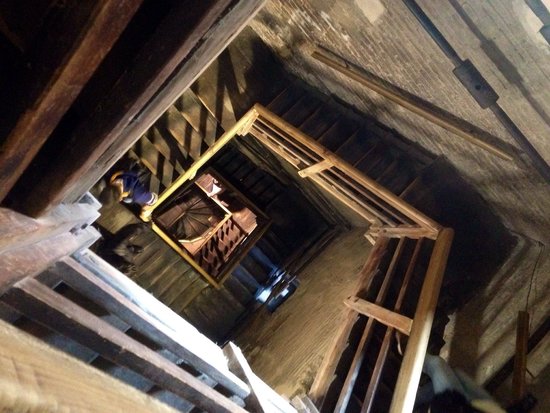
In order to click on metal ledge of wall in this screenshot , I will do `click(421, 15)`, `click(469, 84)`, `click(522, 143)`.